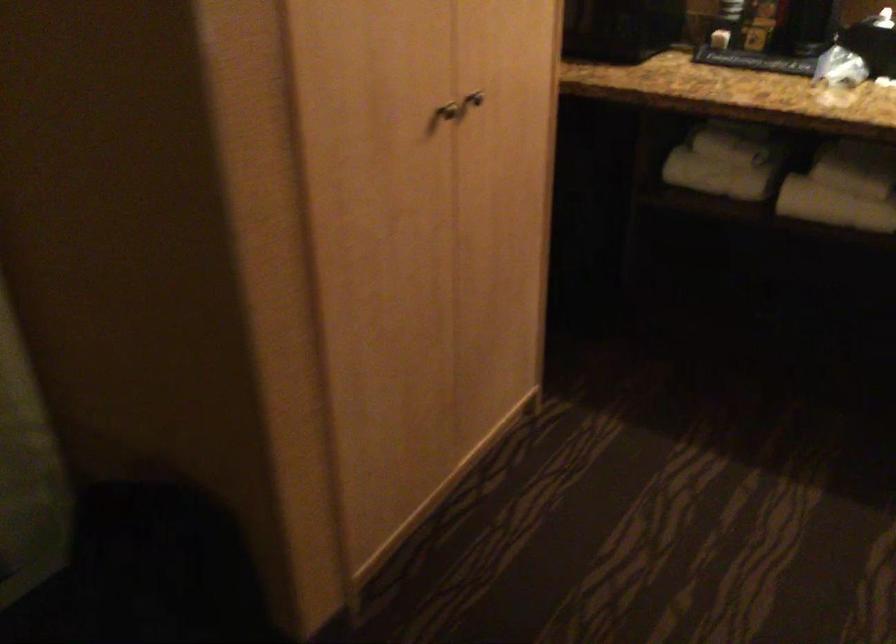
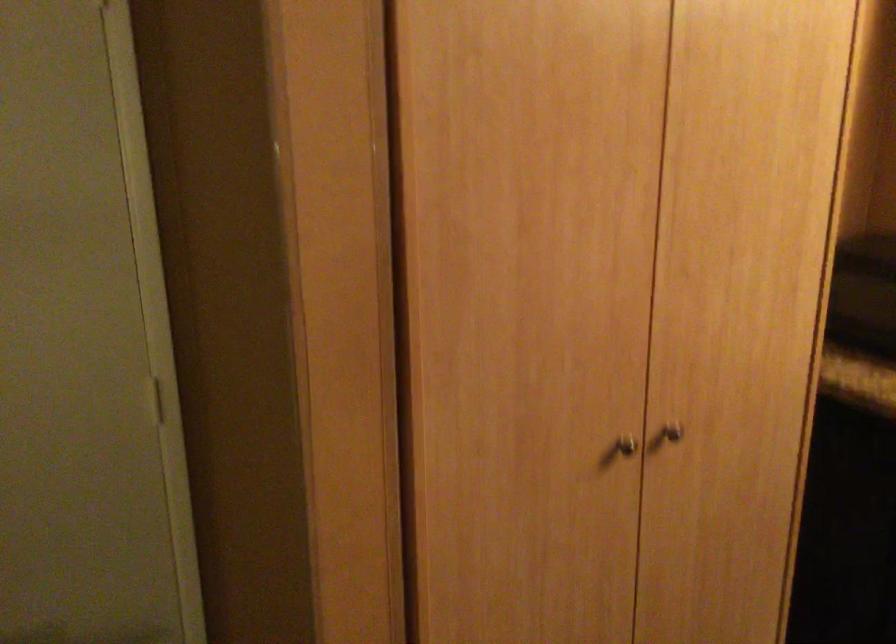
Locate, in the second image, the point that corresponds to (467,90) in the first image.

(673, 431)